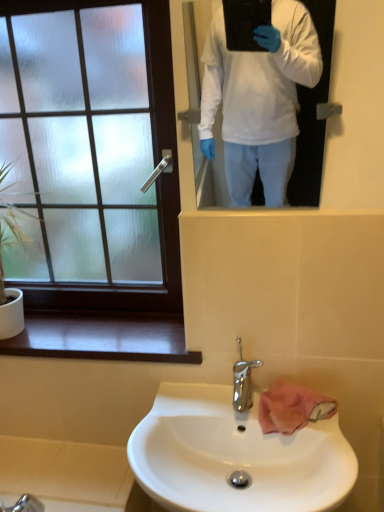
Question: Considering the relative sizes of green leafy plant at left and white glossy sink at lower center in the image provided, is green leafy plant at left taller than white glossy sink at lower center?

Choices:
 (A) no
 (B) yes

Answer: (B)

Question: Is green leafy plant at left turned away from white glossy sink at lower center?

Choices:
 (A) yes
 (B) no

Answer: (B)

Question: Is green leafy plant at left positioned far away from white glossy sink at lower center?

Choices:
 (A) no
 (B) yes

Answer: (A)

Question: Is green leafy plant at left oriented towards white glossy sink at lower center?

Choices:
 (A) no
 (B) yes

Answer: (A)

Question: From a real-world perspective, is green leafy plant at left under white glossy sink at lower center?

Choices:
 (A) yes
 (B) no

Answer: (B)

Question: From the image's perspective, relative to frosted glass window at upper left, is chrome metallic faucet at center above or below?

Choices:
 (A) above
 (B) below

Answer: (B)

Question: Considering their positions, is chrome metallic faucet at center located in front of or behind frosted glass window at upper left?

Choices:
 (A) front
 (B) behind

Answer: (A)

Question: In terms of size, does chrome metallic faucet at center appear bigger or smaller than frosted glass window at upper left?

Choices:
 (A) small
 (B) big

Answer: (A)

Question: Would you say chrome metallic faucet at center is inside or outside frosted glass window at upper left?

Choices:
 (A) outside
 (B) inside

Answer: (A)

Question: From a real-world perspective, is white glossy mirror at upper center positioned above or below green leafy plant at left?

Choices:
 (A) above
 (B) below

Answer: (A)

Question: Considering the positions of white glossy mirror at upper center and green leafy plant at left in the image, is white glossy mirror at upper center wider or thinner than green leafy plant at left?

Choices:
 (A) wide
 (B) thin

Answer: (B)

Question: Would you say white glossy mirror at upper center is to the left or to the right of green leafy plant at left in the picture?

Choices:
 (A) right
 (B) left

Answer: (A)

Question: Does point (248, 132) appear closer or farther from the camera than point (16, 298)?

Choices:
 (A) farther
 (B) closer

Answer: (A)

Question: Which is correct: white glossy mirror at upper center is inside chrome metallic faucet at center, or outside of it?

Choices:
 (A) inside
 (B) outside

Answer: (B)

Question: From a real-world perspective, relative to chrome metallic faucet at center, is white glossy mirror at upper center vertically above or below?

Choices:
 (A) above
 (B) below

Answer: (A)